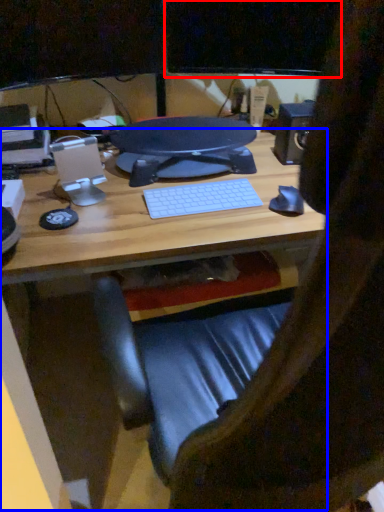
Question: Which object is closer to the camera taking this photo, computer monitor (highlighted by a red box) or desk (highlighted by a blue box)?

Choices:
 (A) computer monitor
 (B) desk

Answer: (B)